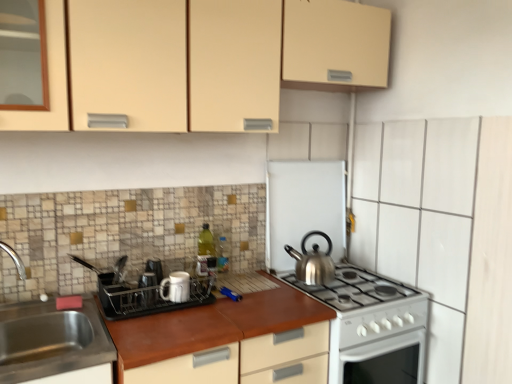
I want to click on free space in front of white ceramic mug at center, arranged as the second appliance when viewed from the left, so click(164, 322).